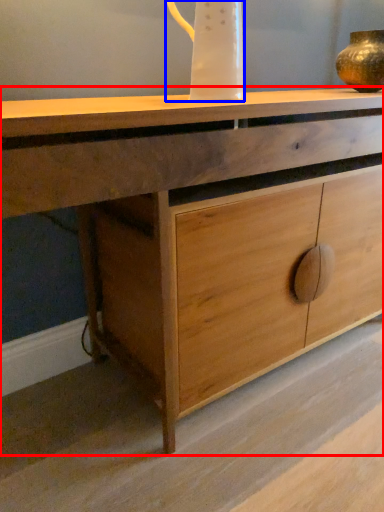
Question: Which object is further to the camera taking this photo, chest of drawers (highlighted by a red box) or jug (highlighted by a blue box)?

Choices:
 (A) chest of drawers
 (B) jug

Answer: (B)